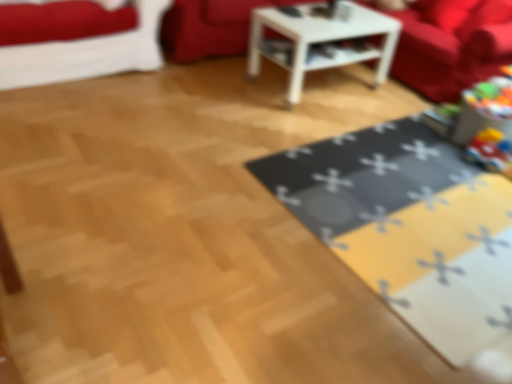
Question: Based on their sizes in the image, would you say velvet red couch at upper center, which appears as the second couch when viewed from the right, is bigger or smaller than white glossy table at center?

Choices:
 (A) small
 (B) big

Answer: (B)

Question: From the image's perspective, is velvet red couch at upper center, which appears as the second couch when viewed from the right, above or below white glossy table at center?

Choices:
 (A) below
 (B) above

Answer: (B)

Question: Based on their relative distances, which object is farther from the velvet red couch at upper center, which appears as the second couch when viewed from the right?

Choices:
 (A) white glossy table at center
 (B) yellow fabric mat at lower right
 (C) velvet red couch at upper left
 (D) velvet red couch at upper right, placed as the first couch when sorted from right to left

Answer: (B)

Question: Considering the real-world distances, which object is closest to the velvet red couch at upper left?

Choices:
 (A) velvet red couch at upper right, the second couch viewed from the left
 (B) white glossy table at center
 (C) velvet red couch at upper center, which appears as the second couch when viewed from the right
 (D) yellow fabric mat at lower right

Answer: (C)